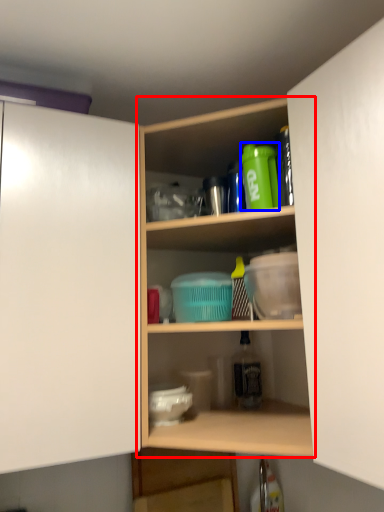
Question: Which of the following is the closest to the observer, shelf (highlighted by a red box) or bottle (highlighted by a blue box)?

Choices:
 (A) shelf
 (B) bottle

Answer: (A)